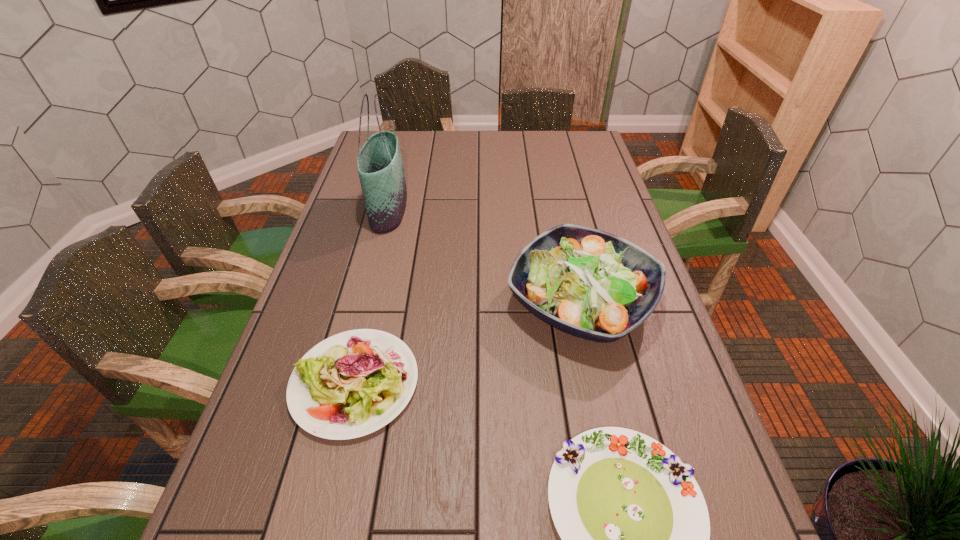
Where is `vacant area that lies between the tallest object and the third tallest object`? vacant area that lies between the tallest object and the third tallest object is located at coordinates (372, 296).

The width and height of the screenshot is (960, 540). In order to click on free space between the leftmost salad plate and the tote bag in this screenshot , I will do `click(372, 296)`.

Identify the location of object that stands as the closest to the second tallest salad plate. The width and height of the screenshot is (960, 540). (592, 284).

The width and height of the screenshot is (960, 540). Identify the location of the closest object relative to the second shortest object. pos(592,284).

Image resolution: width=960 pixels, height=540 pixels. Find the location of `salad plate that stands as the third closest to the tallest object`. salad plate that stands as the third closest to the tallest object is located at coordinates (635, 532).

Select which salad plate is the closest to the leftmost salad plate. Please provide its 2D coordinates. Your answer should be formatted as a tuple, i.e. [(x, y)], where the tuple contains the x and y coordinates of a point satisfying the conditions above.

[(592, 284)]

Find the location of a particular element. Image resolution: width=960 pixels, height=540 pixels. vacant area that satisfies the following two spatial constraints: 1. on the back side of the tallest salad plate; 2. on the left side of the third tallest object is located at coordinates (373, 303).

Find the location of `vacant position in the image that satisfies the following two spatial constraints: 1. on the front side of the tallest object; 2. on the right side of the leftmost salad plate`. vacant position in the image that satisfies the following two spatial constraints: 1. on the front side of the tallest object; 2. on the right side of the leftmost salad plate is located at coordinates (344, 383).